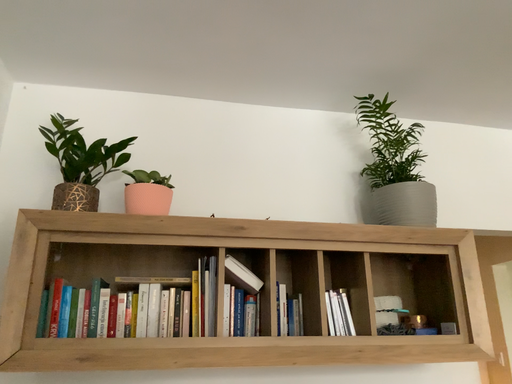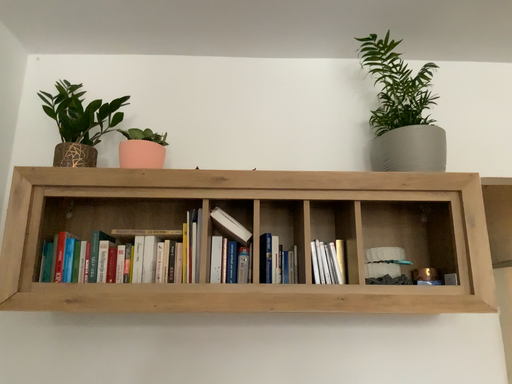
Question: Which way did the camera rotate in the video?

Choices:
 (A) rotated right
 (B) rotated left

Answer: (B)